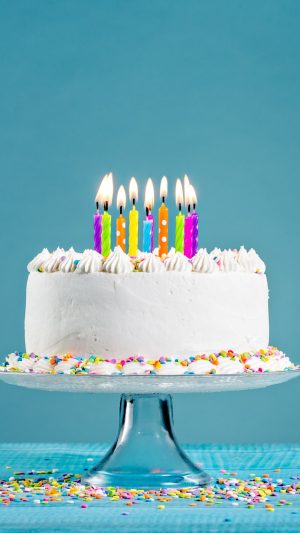
This screenshot has height=533, width=300. Identify the location of polka dot candle. (164, 232), (151, 217), (122, 233), (196, 231), (147, 233).